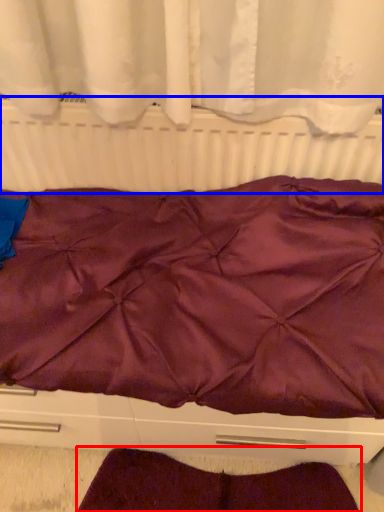
Question: Which object is closer to the camera taking this photo, blanket (highlighted by a red box) or radiator (highlighted by a blue box)?

Choices:
 (A) blanket
 (B) radiator

Answer: (B)